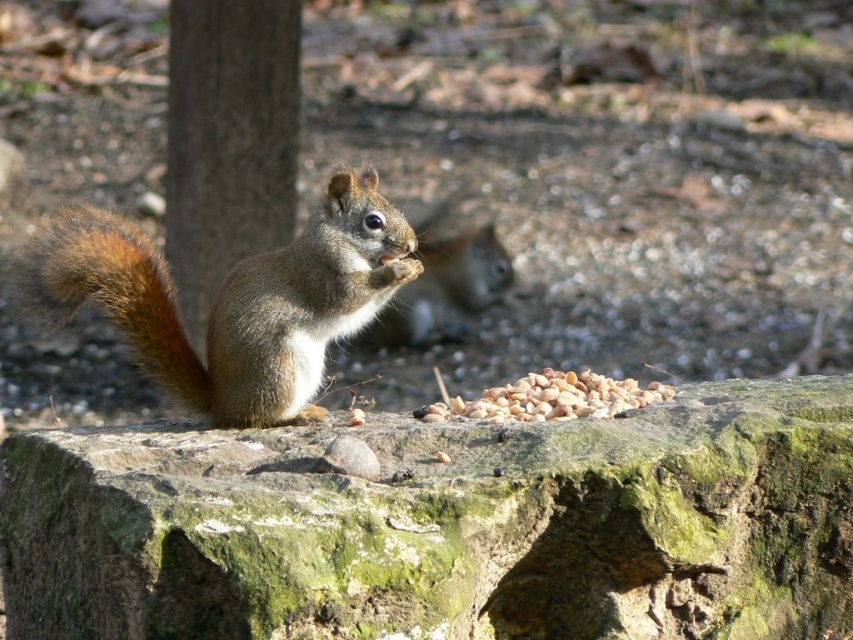
Which is behind, point (250, 362) or point (109, 252)?

The point (250, 362) is more distant.

Does brown fur squirrel at center appear on the left side of brown furry tail at left?

Incorrect, brown fur squirrel at center is not on the left side of brown furry tail at left.

You are a GUI agent. You are given a task and a screenshot of the screen. Output one action in this format:
    pyautogui.click(x=<x>, y=<y>)
    Task: Click on the brown fur squirrel at center
    Image resolution: width=853 pixels, height=640 pixels.
    Given the screenshot: What is the action you would take?
    pyautogui.click(x=233, y=300)

Can you confirm if green mossy stone at center is shorter than brown fur squirrel at center?

Indeed, green mossy stone at center has a lesser height compared to brown fur squirrel at center.

The height and width of the screenshot is (640, 853). Identify the location of green mossy stone at center. (444, 525).

Is brown fur squirrel at center below brown rough bark at left?

Indeed, brown fur squirrel at center is positioned under brown rough bark at left.

Can you confirm if brown fur squirrel at center is smaller than brown rough bark at left?

Yes.

Identify the location of brown fur squirrel at center. The height and width of the screenshot is (640, 853). (233, 300).